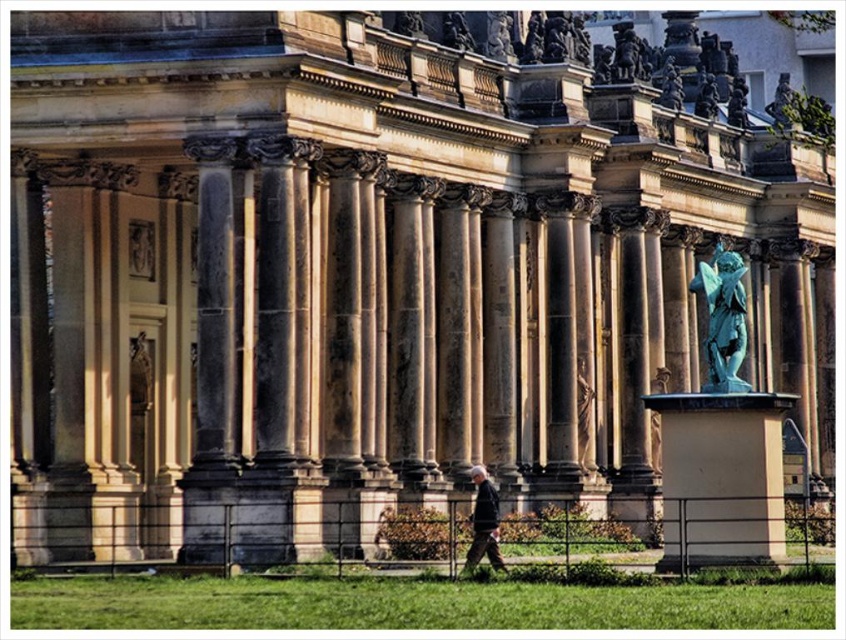
Is point (735, 390) more distant than point (788, 90)?

That is False.

Based on the photo, does green patina statue at center-right have a lesser width compared to green patina statue at upper right?

In fact, green patina statue at center-right might be wider than green patina statue at upper right.

Where is `green patina statue at center-right`? This screenshot has width=846, height=640. green patina statue at center-right is located at coordinates (723, 320).

Between smooth beige statue at center and green patina statue at upper right, which one has more height?

green patina statue at upper right

Looking at this image, can you confirm if smooth beige statue at center is smaller than green patina statue at upper right?

Yes.

Is point (584, 360) less distant than point (779, 99)?

Yes, it is in front of point (779, 99).

Find the location of `smooth beige statue at center`. smooth beige statue at center is located at coordinates [583, 410].

In the scene shown: Measure the distance between point (x=735, y=310) and camera.

Point (x=735, y=310) and camera are 64.39 meters apart.

Which is behind, point (707, 378) or point (476, 506)?

Positioned behind is point (707, 378).

Is point (709, 378) in front of point (497, 547)?

That is False.

This screenshot has height=640, width=846. In order to click on green patina statue at center-right in this screenshot , I will do `click(723, 320)`.